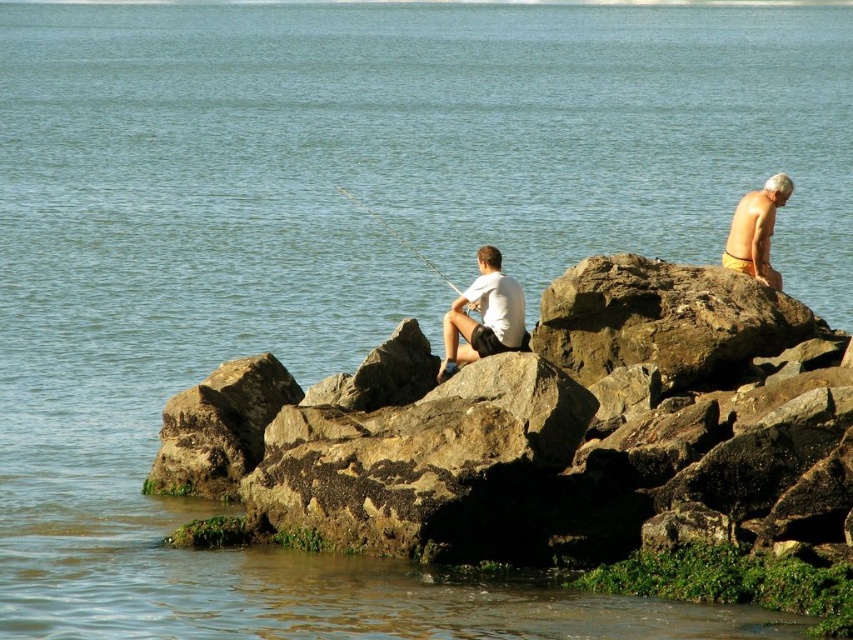
Question: From the image, what is the correct spatial relationship of yellow matte shorts at upper right in relation to smooth white fishing pole at center?

Choices:
 (A) above
 (B) below

Answer: (A)

Question: Does white matte shirt at center appear on the right side of yellow matte shorts at upper right?

Choices:
 (A) yes
 (B) no

Answer: (B)

Question: Which of these objects is positioned closest to the white matte shirt at center?

Choices:
 (A) yellow matte shorts at upper right
 (B) smooth white fishing pole at center

Answer: (B)

Question: Which object is positioned farthest from the white matte shirt at center?

Choices:
 (A) yellow matte shorts at upper right
 (B) smooth white fishing pole at center

Answer: (A)

Question: Which object is farther from the camera taking this photo?

Choices:
 (A) yellow matte shorts at upper right
 (B) smooth white fishing pole at center

Answer: (A)

Question: Does yellow matte shorts at upper right appear over smooth white fishing pole at center?

Choices:
 (A) no
 (B) yes

Answer: (B)